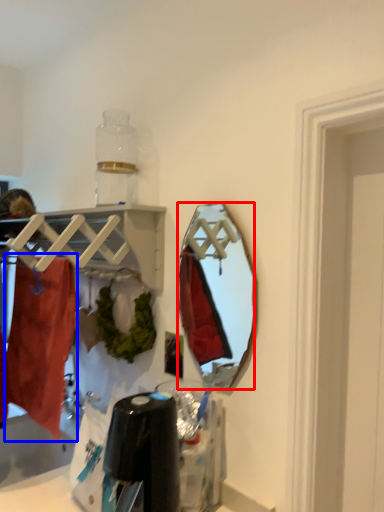
Question: Which point is further to the camera, mirror (highlighted by a red box) or clothing (highlighted by a blue box)?

Choices:
 (A) mirror
 (B) clothing

Answer: (B)